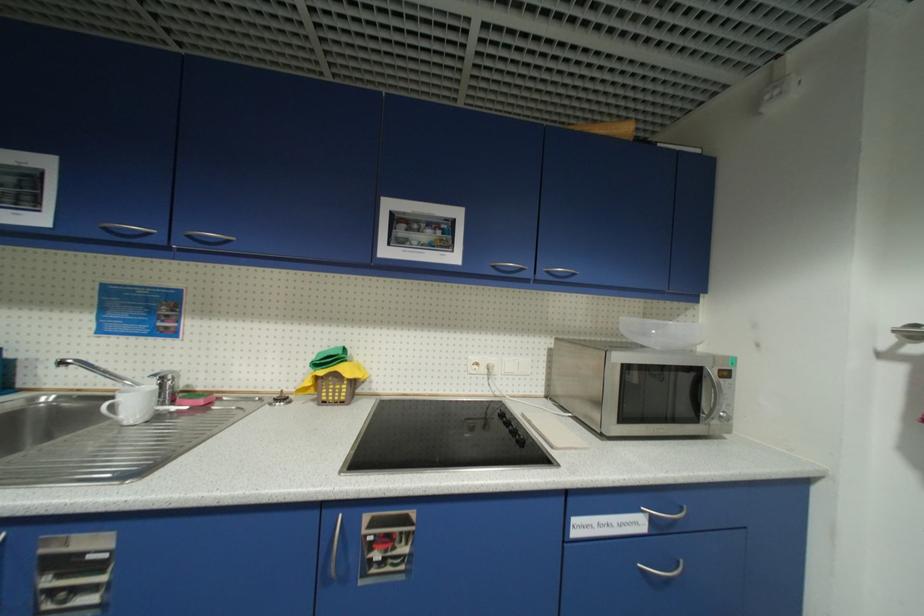
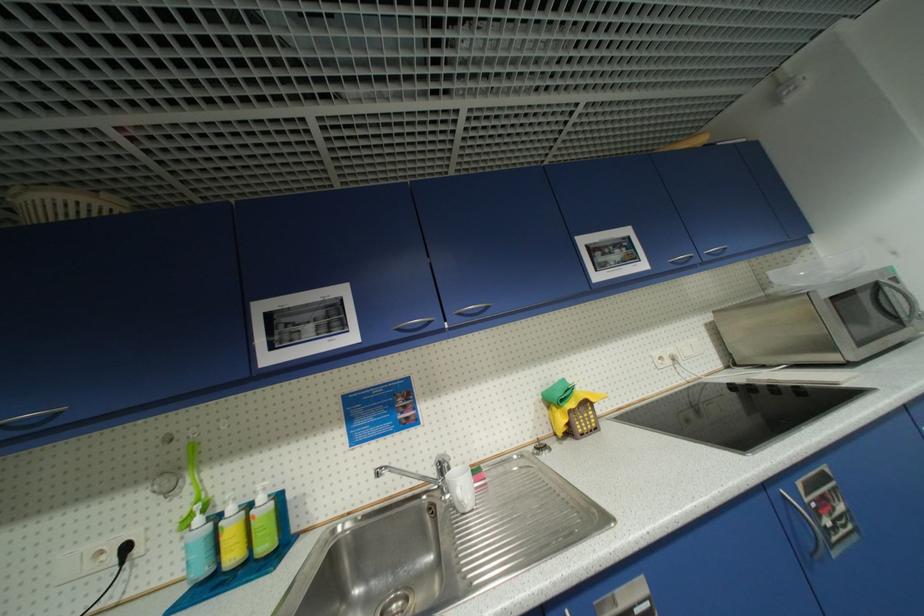
Where in the second image is the point corresponding to (x=112, y=230) from the first image?

(405, 331)